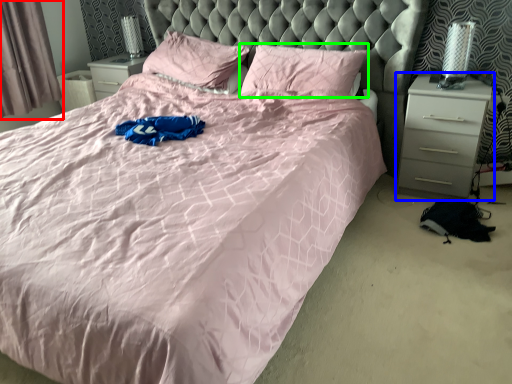
Question: Which is nearer to the curtain (highlighted by a red box)? nightstand (highlighted by a blue box) or pillow (highlighted by a green box).

Choices:
 (A) nightstand
 (B) pillow

Answer: (B)